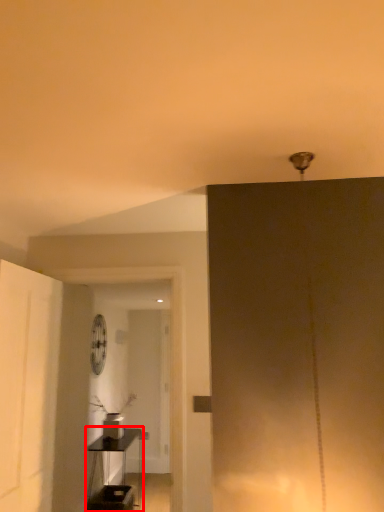
Question: From the image's perspective, considering the relative positions of table (annotated by the red box) and fan in the image provided, where is table (annotated by the red box) located with respect to the staircase?

Choices:
 (A) below
 (B) above

Answer: (A)